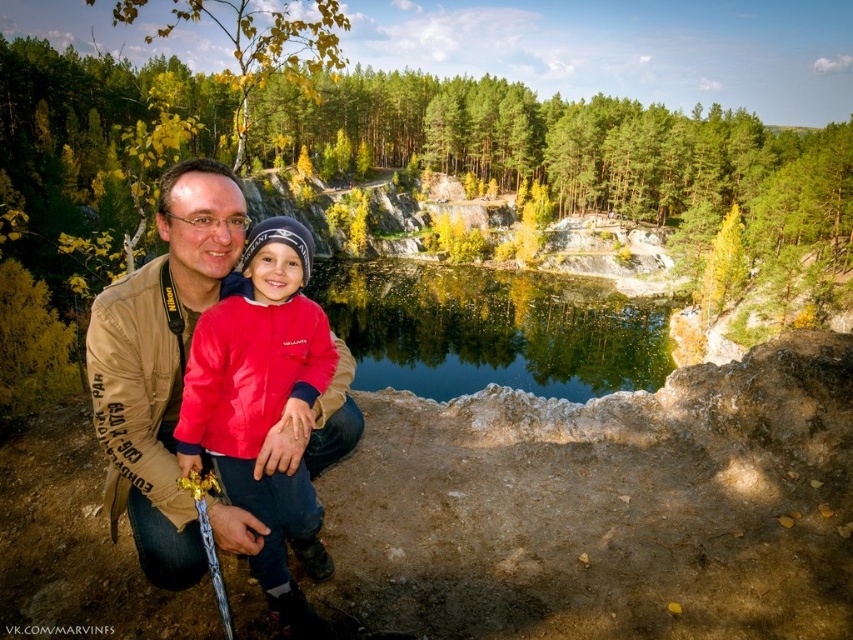
Can you confirm if clear blue water at center is wider than matte red jacket at center?

Correct, the width of clear blue water at center exceeds that of matte red jacket at center.

Does clear blue water at center have a greater height compared to matte red jacket at center?

Indeed, clear blue water at center has a greater height compared to matte red jacket at center.

Who is more distant from viewer, (653, 321) or (167, 502)?

Positioned behind is point (653, 321).

This screenshot has height=640, width=853. In order to click on clear blue water at center in this screenshot , I will do `click(490, 330)`.

Does red fleece jacket at center lie in front of matte red jacket at center?

That is True.

The width and height of the screenshot is (853, 640). What are the coordinates of `red fleece jacket at center` in the screenshot? It's located at (264, 406).

Where is `red fleece jacket at center`? red fleece jacket at center is located at coordinates (264, 406).

Is clear blue water at center above red fleece jacket at center?

Yes.

Where is `clear blue water at center`? The width and height of the screenshot is (853, 640). clear blue water at center is located at coordinates (490, 330).

The width and height of the screenshot is (853, 640). Identify the location of clear blue water at center. (490, 330).